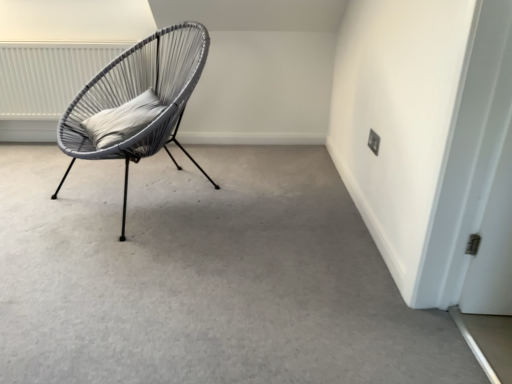
Question: Is black plastic electric outlet at upper right closer to the viewer compared to matte gray carpet at center?

Choices:
 (A) yes
 (B) no

Answer: (B)

Question: Considering the relative positions of black plastic electric outlet at upper right and matte gray carpet at center in the image provided, is black plastic electric outlet at upper right to the right of matte gray carpet at center from the viewer's perspective?

Choices:
 (A) yes
 (B) no

Answer: (A)

Question: From the image's perspective, is black plastic electric outlet at upper right over matte gray carpet at center?

Choices:
 (A) yes
 (B) no

Answer: (A)

Question: From a real-world perspective, is black plastic electric outlet at upper right positioned under matte gray carpet at center based on gravity?

Choices:
 (A) no
 (B) yes

Answer: (A)

Question: Is black plastic electric outlet at upper right further to the viewer compared to matte gray carpet at center?

Choices:
 (A) yes
 (B) no

Answer: (A)

Question: Is black plastic electric outlet at upper right next to matte gray carpet at center?

Choices:
 (A) no
 (B) yes

Answer: (A)

Question: From the image's perspective, would you say white soft cushion at center is shown under black plastic electric outlet at upper right?

Choices:
 (A) yes
 (B) no

Answer: (B)

Question: Considering the relative sizes of white soft cushion at center and black plastic electric outlet at upper right in the image provided, is white soft cushion at center wider than black plastic electric outlet at upper right?

Choices:
 (A) yes
 (B) no

Answer: (A)

Question: Is white soft cushion at center taller than black plastic electric outlet at upper right?

Choices:
 (A) yes
 (B) no

Answer: (A)

Question: Does white soft cushion at center have a lesser width compared to black plastic electric outlet at upper right?

Choices:
 (A) yes
 (B) no

Answer: (B)

Question: From the image's perspective, is white soft cushion at center on black plastic electric outlet at upper right?

Choices:
 (A) yes
 (B) no

Answer: (A)

Question: Can we say white soft cushion at center lies outside black plastic electric outlet at upper right?

Choices:
 (A) yes
 (B) no

Answer: (A)

Question: Is the depth of white textured radiator at upper left greater than that of black plastic electric outlet at upper right?

Choices:
 (A) no
 (B) yes

Answer: (B)